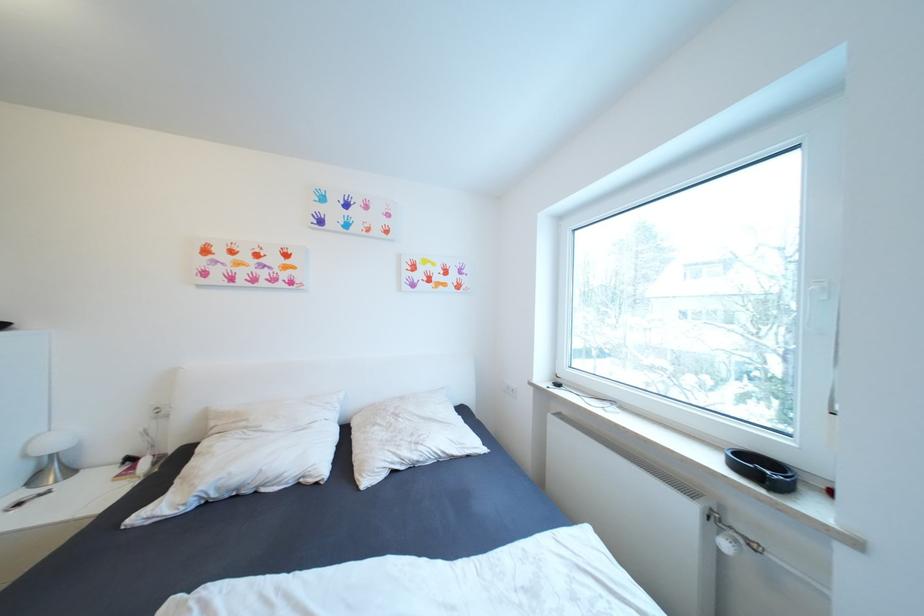
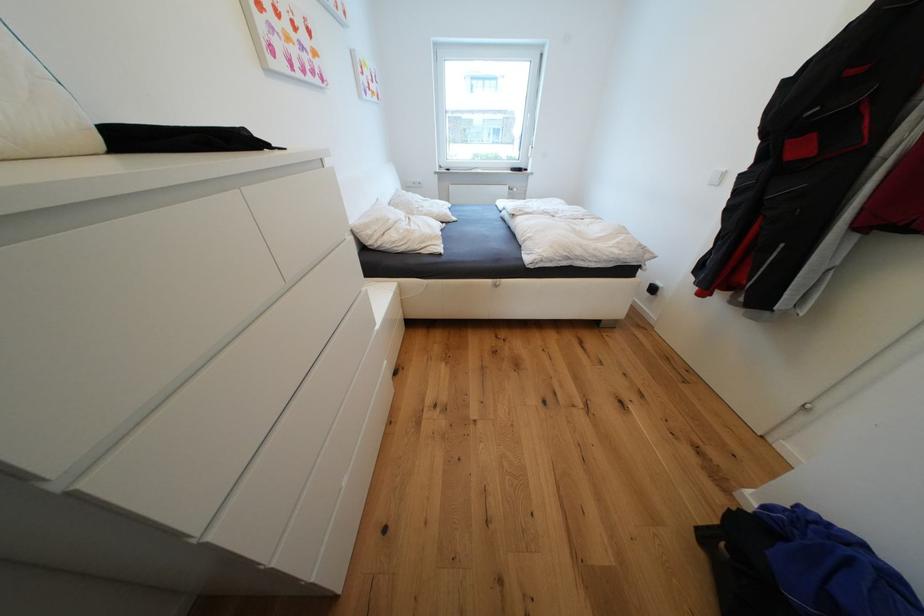
Where in the second image is the point corresponding to (x=220, y=424) from the first image?

(377, 233)